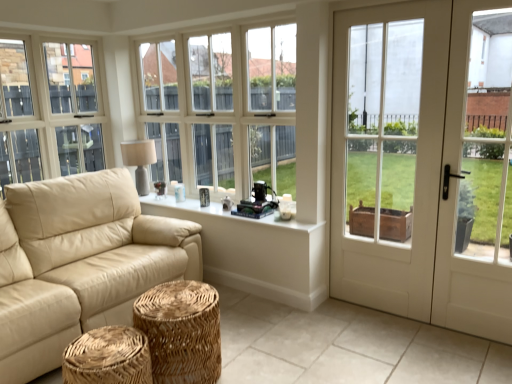
The width and height of the screenshot is (512, 384). I want to click on spots to the right of woven natural stool at center, which is the first stool in back-to-front order, so (x=258, y=359).